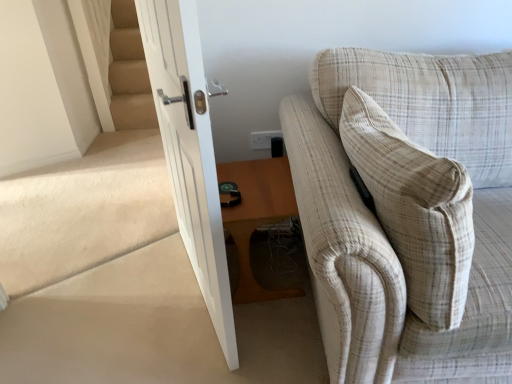
Where is `free space to the left of white glossy door at center`? Image resolution: width=512 pixels, height=384 pixels. free space to the left of white glossy door at center is located at coordinates (115, 296).